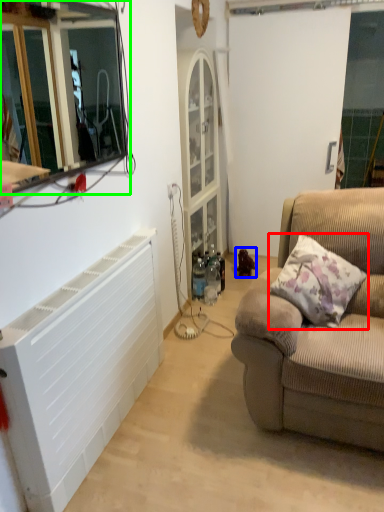
Question: Which object is positioned closest to pillow (highlighted by a red box)? Select from toy (highlighted by a blue box) and window frame (highlighted by a green box).

Choices:
 (A) toy
 (B) window frame

Answer: (A)